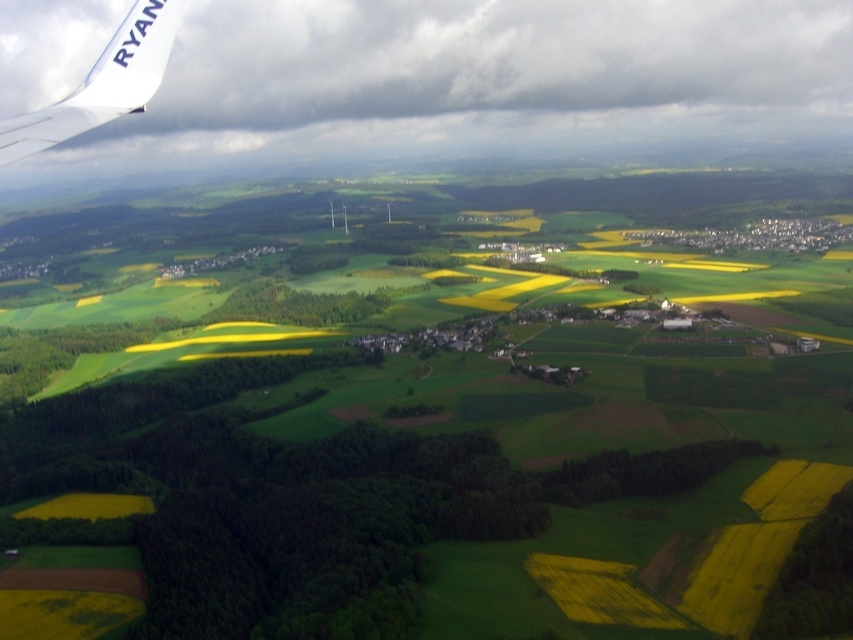
Question: Which point is closer to the camera taking this photo?

Choices:
 (A) (67, 83)
 (B) (102, 60)

Answer: (B)

Question: Among these points, which one is farthest from the camera?

Choices:
 (A) (573, 20)
 (B) (129, 26)

Answer: (A)

Question: Observing the image, what is the correct spatial positioning of white fluffy cloud at upper left in reference to white matte airplane wing at upper left?

Choices:
 (A) below
 (B) above

Answer: (B)

Question: Is white fluffy cloud at upper left bigger than white matte airplane wing at upper left?

Choices:
 (A) yes
 (B) no

Answer: (A)

Question: Does white fluffy cloud at upper left appear under white matte airplane wing at upper left?

Choices:
 (A) no
 (B) yes

Answer: (A)

Question: Which point is closer to the camera?

Choices:
 (A) white matte airplane wing at upper left
 (B) white fluffy cloud at upper left

Answer: (A)